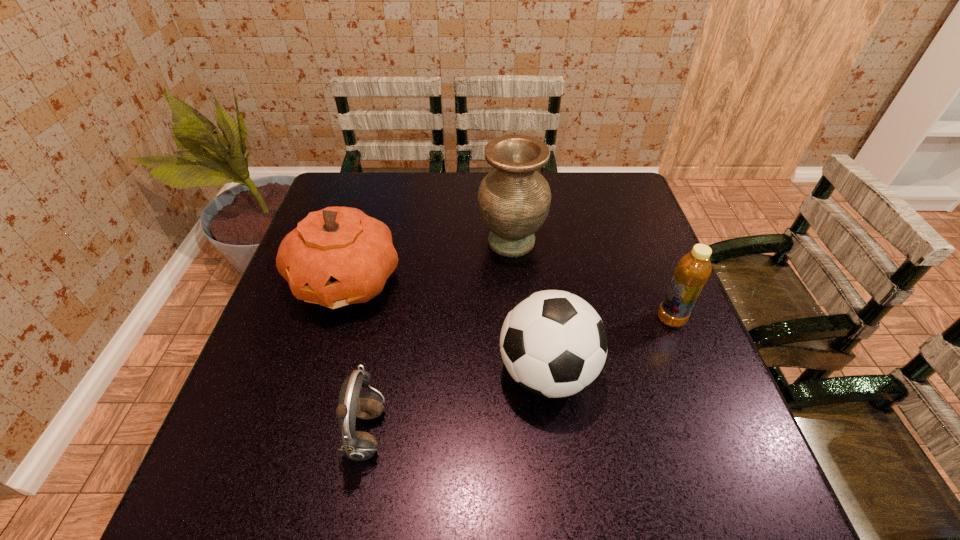
The image size is (960, 540). What are the coordinates of `free space in the image that satisfies the following two spatial constraints: 1. on the front-facing side of the bottle; 2. on the right side of the pumpkin` in the screenshot? It's located at (335, 319).

Identify the location of vacant area that satisfies the following two spatial constraints: 1. on the front-facing side of the pumpkin; 2. on the right side of the soccer ball. Image resolution: width=960 pixels, height=540 pixels. (319, 373).

Identify the location of vacant space that satisfies the following two spatial constraints: 1. on the front side of the vase; 2. on the ear pads of the earphone. The width and height of the screenshot is (960, 540). (526, 435).

Locate an element on the screen. The width and height of the screenshot is (960, 540). free space that satisfies the following two spatial constraints: 1. on the front side of the soccer ball; 2. on the ear pads of the earphone is located at coordinates (555, 435).